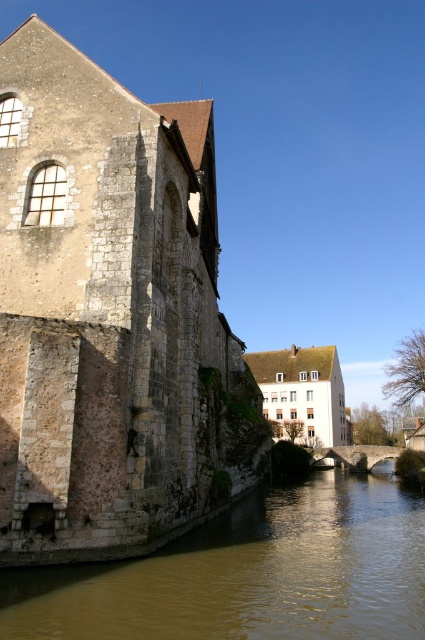
You are a delivery drone with a wingspan of 5 feet. You need to fly from the stone wall at left to the brown stone river at lower left. Is there enough space between them for your drone to pass through?

The stone wall at left and brown stone river at lower left are 66.89 feet apart from each other, so yes, the drone can pass through the space between them since the distance is much larger than the drone wingspan of 5 feet.

You are a painter setting up your easel to capture the riverside scene. You want to ensure that both the stone wall at left and the brown stone river at lower left are clearly visible in your painting. Given their sizes, which object should you position closer to the center of your canvas to emphasize its prominence?

The stone wall at left is bigger than the brown stone river at lower left, so to emphasize its prominence, you should position the stone wall at left closer to the center of your canvas.

You are standing at the riverside and see two points marked in the image. Which point, point (144, 266) or point (300, 545), is closer to you?

Point (144, 266) is closer to the camera than point (300, 545).